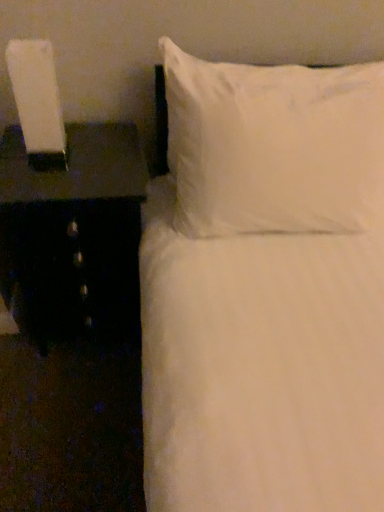
The height and width of the screenshot is (512, 384). In order to click on white glossy lamp at left in this screenshot , I will do `click(38, 102)`.

Locate an element on the screen. This screenshot has width=384, height=512. white soft pillow at upper right is located at coordinates (273, 146).

What are the coordinates of `white glossy lamp at left` in the screenshot? It's located at (38, 102).

In the scene shown: Is white glossy lamp at left bigger than black glossy nightstand at left?

Actually, white glossy lamp at left might be smaller than black glossy nightstand at left.

Is white glossy lamp at left shorter than black glossy nightstand at left?

Yes, white glossy lamp at left is shorter than black glossy nightstand at left.

Based on the photo, from a real-world perspective, is white glossy lamp at left located higher than black glossy nightstand at left?

Indeed, from a real-world perspective, white glossy lamp at left stands above black glossy nightstand at left.

In terms of width, does white soft pillow at upper right look wider or thinner when compared to black glossy nightstand at left?

white soft pillow at upper right is thinner than black glossy nightstand at left.

From the image's perspective, is white soft pillow at upper right over black glossy nightstand at left?

Indeed, from the image's perspective, white soft pillow at upper right is shown above black glossy nightstand at left.

Would you say white soft pillow at upper right is to the left or to the right of black glossy nightstand at left in the picture?

white soft pillow at upper right is to the right of black glossy nightstand at left.

Which of these two, black glossy nightstand at left or white soft pillow at upper right, is wider?

Wider between the two is black glossy nightstand at left.

Can you confirm if black glossy nightstand at left is smaller than white soft pillow at upper right?

Yes, black glossy nightstand at left is smaller than white soft pillow at upper right.

Does point (67, 189) lie behind point (252, 83)?

Yes, it is behind point (252, 83).

You are a GUI agent. You are given a task and a screenshot of the screen. Output one action in this format:
    pyautogui.click(x=<x>, y=<y>)
    Task: Click on the nightstand directly beneath the white soft pillow at upper right (from a real-world perspective)
    
    Given the screenshot: What is the action you would take?
    pyautogui.click(x=73, y=236)

Is white glossy lamp at left looking in the opposite direction of white soft pillow at upper right?

That's not correct — white glossy lamp at left is not looking away from white soft pillow at upper right.

Between point (34, 159) and point (308, 141), which one is positioned behind?

The point (34, 159) is farther.

Looking at this image, which object is further away from the camera, white glossy lamp at left or white soft pillow at upper right?

Positioned behind is white glossy lamp at left.

Between white glossy lamp at left and white soft pillow at upper right, which one has smaller width?

white glossy lamp at left is thinner.

Which of these two, white soft pillow at upper right or white glossy lamp at left, is thinner?

white glossy lamp at left.

Based on their sizes in the image, would you say white soft pillow at upper right is bigger or smaller than white glossy lamp at left?

Clearly, white soft pillow at upper right is larger in size than white glossy lamp at left.

Is white glossy lamp at left at the back of white soft pillow at upper right?

No.

Is white soft pillow at upper right situated inside white glossy lamp at left or outside?

The correct answer is: outside.

Is black glossy nightstand at left not close to white glossy lamp at left?

black glossy nightstand at left is near white glossy lamp at left, not far away.

Does point (71, 126) appear closer or farther from the camera than point (27, 74)?

Point (71, 126).

Can you confirm if black glossy nightstand at left is smaller than white glossy lamp at left?

Actually, black glossy nightstand at left might be larger than white glossy lamp at left.

Considering the relative sizes of black glossy nightstand at left and white glossy lamp at left in the image provided, is black glossy nightstand at left taller than white glossy lamp at left?

Yes.

What are the coordinates of `bedside lamp located above the black glossy nightstand at left (from a real-world perspective)` in the screenshot? It's located at (38, 102).

Find the location of a particular element. pillow above the black glossy nightstand at left (from the image's perspective) is located at coordinates (273, 146).

From the image, which object appears to be nearer to white soft pillow at upper right, black glossy nightstand at left or white glossy lamp at left?

Among the two, black glossy nightstand at left is located nearer to white soft pillow at upper right.

Which object lies nearer to the anchor point white glossy lamp at left, white soft pillow at upper right or black glossy nightstand at left?

black glossy nightstand at left.

Looking at the image, which one is located closer to black glossy nightstand at left, white glossy lamp at left or white soft pillow at upper right?

white glossy lamp at left is positioned closer to the anchor black glossy nightstand at left.

When comparing their distances from white glossy lamp at left, does black glossy nightstand at left or white soft pillow at upper right seem further?

white soft pillow at upper right.

Based on their spatial positions, is white soft pillow at upper right or white glossy lamp at left closer to black glossy nightstand at left?

The object closer to black glossy nightstand at left is white glossy lamp at left.

Looking at the image, which one is located closer to white soft pillow at upper right, white glossy lamp at left or black glossy nightstand at left?

Based on the image, black glossy nightstand at left appears to be nearer to white soft pillow at upper right.

The width and height of the screenshot is (384, 512). Identify the location of nightstand between white glossy lamp at left and white soft pillow at upper right in the horizontal direction. (73, 236).